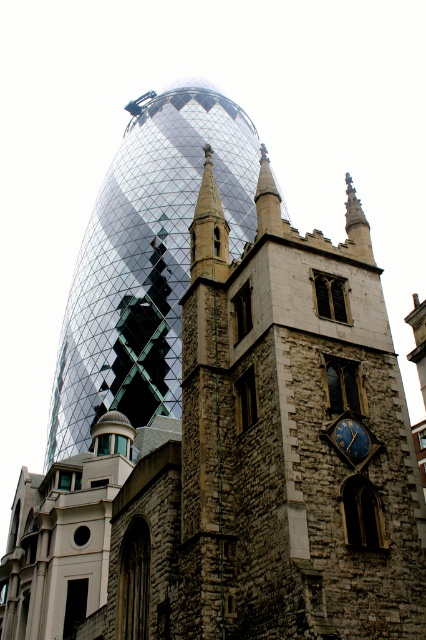
Question: Based on their relative distances, which object is farther from the reflective glass tower at center?

Choices:
 (A) stone spire at center
 (B) gold metallic clock at right

Answer: (B)

Question: Is reflective glass tower at center smaller than stone spire at center?

Choices:
 (A) no
 (B) yes

Answer: (A)

Question: Among these objects, which one is farthest from the camera?

Choices:
 (A) reflective glass tower at center
 (B) gold metallic clock at right

Answer: (A)

Question: Does stone spire at center come in front of gold metallic clock at right?

Choices:
 (A) no
 (B) yes

Answer: (A)

Question: Which point is closer to the camera?

Choices:
 (A) (340, 432)
 (B) (209, 241)
 (C) (170, 168)

Answer: (A)

Question: Is reflective glass tower at center smaller than stone spire at center?

Choices:
 (A) no
 (B) yes

Answer: (A)